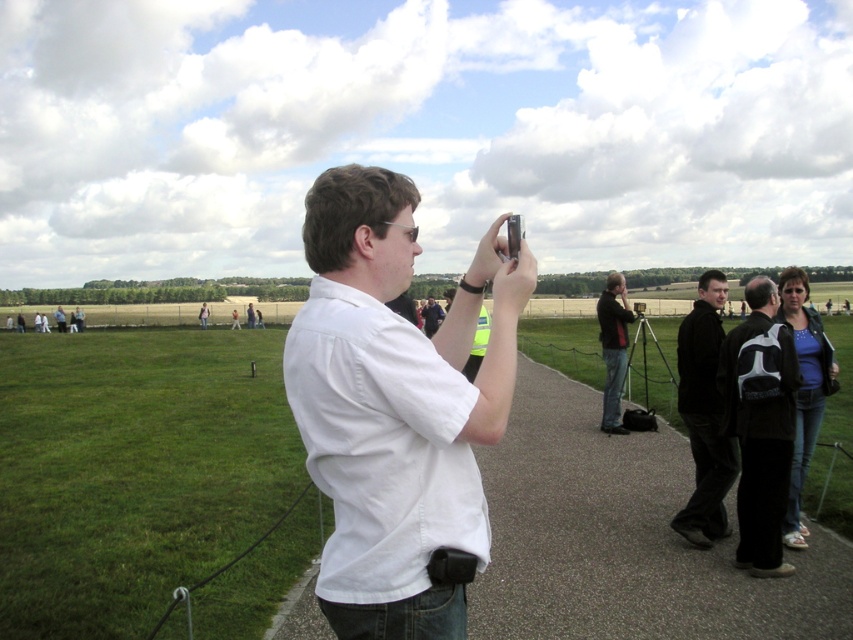
Question: Can you confirm if white shirt at center is smaller than black matte jacket at lower right?

Choices:
 (A) no
 (B) yes

Answer: (A)

Question: Does white shirt at center have a smaller size compared to black backpack at center right?

Choices:
 (A) yes
 (B) no

Answer: (B)

Question: Does white matte shirt at center have a greater width compared to white shirt at center?

Choices:
 (A) no
 (B) yes

Answer: (A)

Question: Which object appears farthest from the camera in this image?

Choices:
 (A) black matte jacket at lower right
 (B) white matte shirt at center
 (C) black backpack at center right

Answer: (A)

Question: Among these points, which one is nearest to the camera?

Choices:
 (A) (555, 480)
 (B) (694, 333)
 (C) (312, 246)
 (D) (786, 465)

Answer: (C)

Question: Which point is closer to the camera taking this photo?

Choices:
 (A) (680, 554)
 (B) (793, 401)
 (C) (717, 442)

Answer: (B)